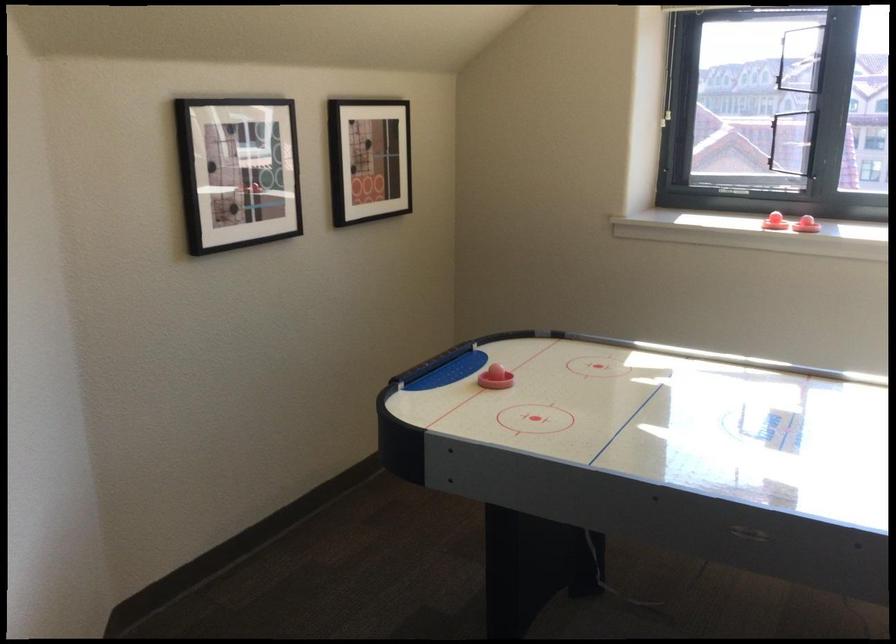
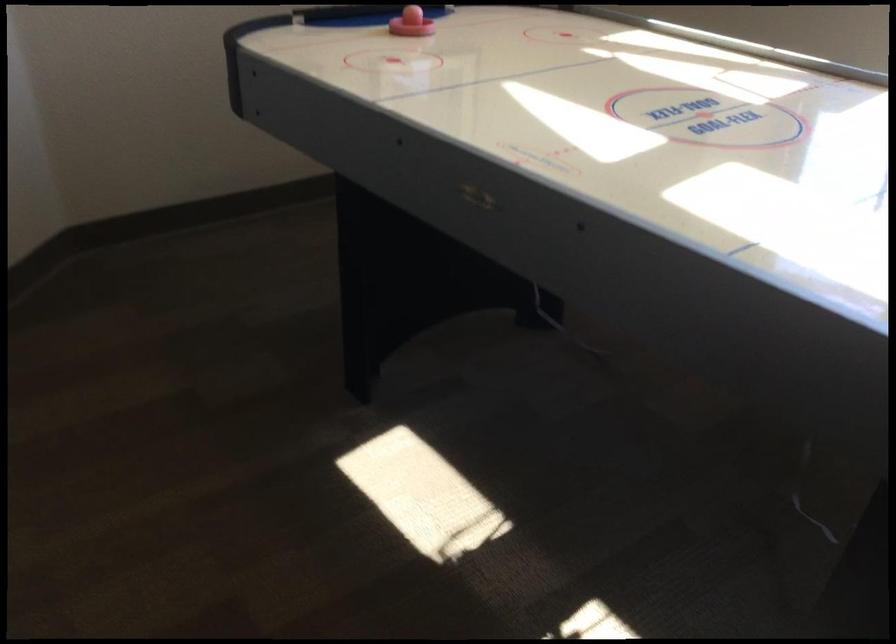
The first image is from the beginning of the video and the second image is from the end. How did the camera likely rotate when shooting the video?

The camera rotated toward left-down.